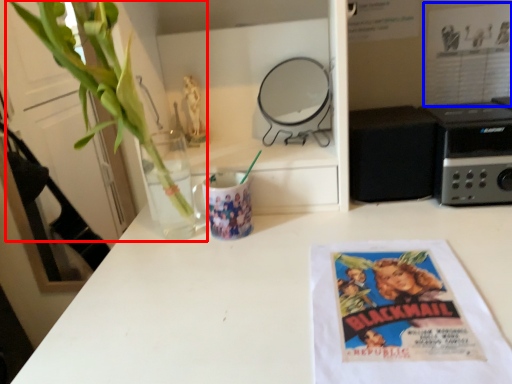
Question: Which point is closer to the camera, houseplant (highlighted by a red box) or movie poster (highlighted by a blue box)?

Choices:
 (A) houseplant
 (B) movie poster

Answer: (A)